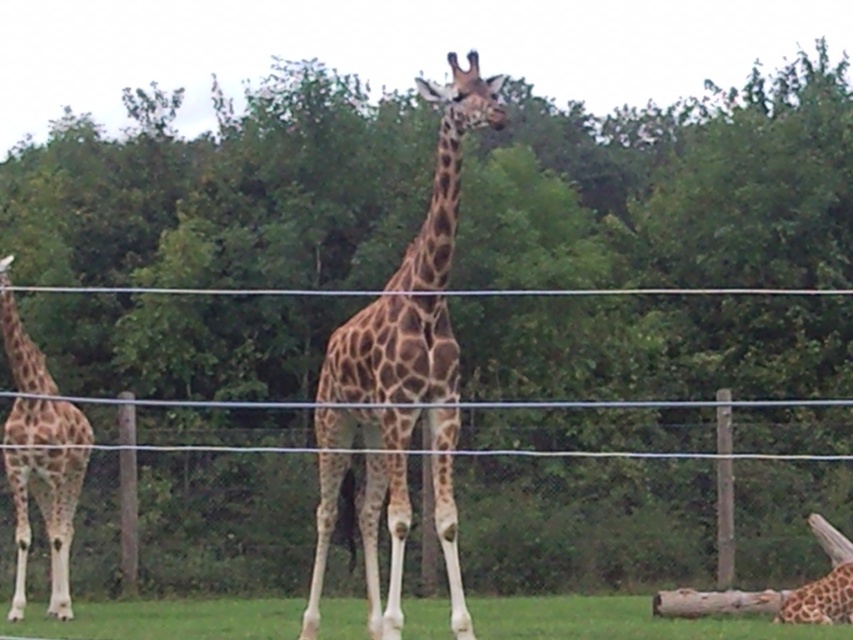
You are a zookeeper who needs to ensure the safety of the giraffes. The wire mesh fence at center and the green grass at lower center are part of the enclosure. Considering their heights, which one is more likely to block the giraffes from escaping?

The wire mesh fence at center is much taller than the green grass at lower center, so it is more likely to block the giraffes from escaping.

From the picture: You are a zookeeper planning to mow the lawn between the green grass at lower center and the spotted fur giraffe at left. Which area requires more attention in terms of width?

The green grass at lower center requires more attention because its width surpasses that of the spotted fur giraffe at left.

You are a zookeeper observing the giraffes in their enclosure. You notice both spotted fur giraffe at center and spotted fur giraffe at left. Which giraffe do you think is bigger?

The spotted fur giraffe at center is larger in size compared to the spotted fur giraffe at left.